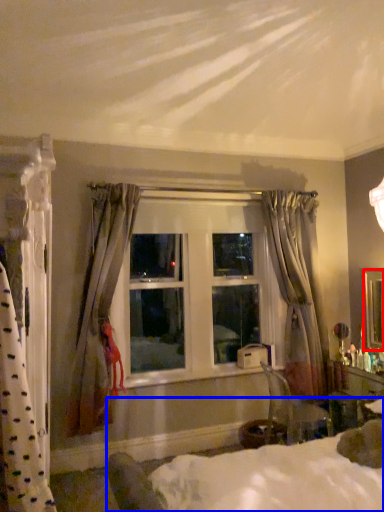
Question: Which object is closer to the camera taking this photo, mirror (highlighted by a red box) or bed (highlighted by a blue box)?

Choices:
 (A) mirror
 (B) bed

Answer: (B)